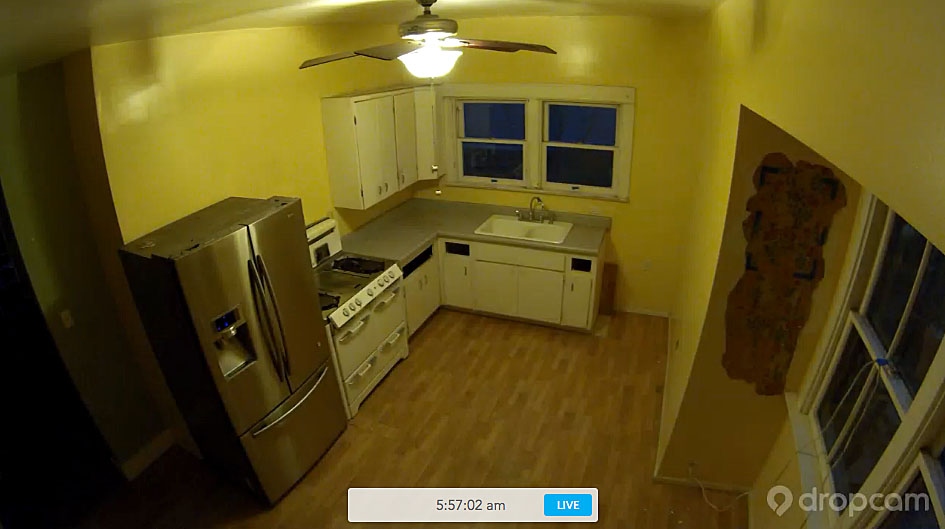
This screenshot has height=529, width=945. In order to click on windows in this screenshot , I will do `click(484, 129)`, `click(590, 130)`, `click(906, 335)`, `click(915, 464)`.